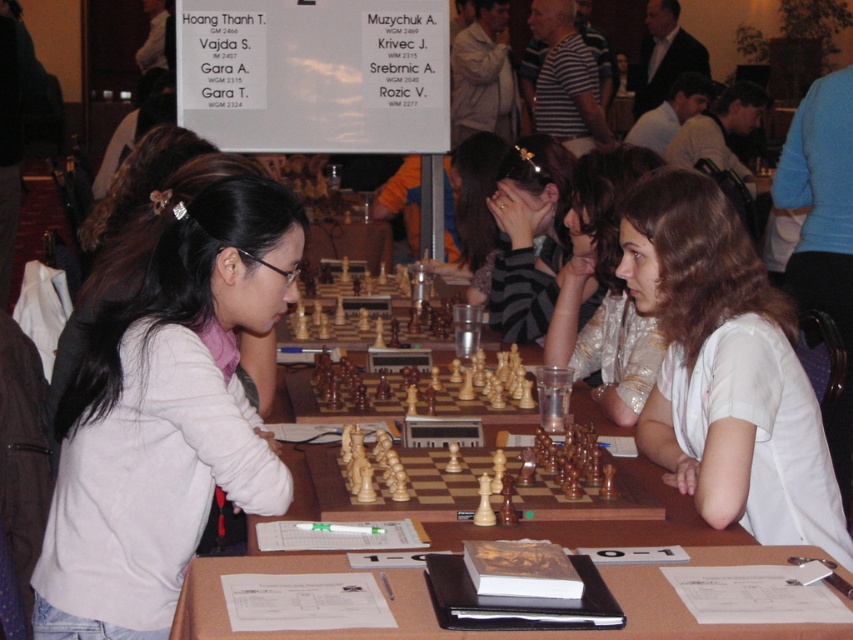
Question: Which of these objects is positioned closest to the wooden chess set at center?

Choices:
 (A) wooden table at center
 (B) white matte shirt at center
 (C) striped fabric headband at center

Answer: (C)

Question: Is striped fabric headband at center below wooden chess set at center?

Choices:
 (A) yes
 (B) no

Answer: (B)

Question: Is wooden at center thinner than wooden chess set at center?

Choices:
 (A) yes
 (B) no

Answer: (B)

Question: Which object is farther from the camera taking this photo?

Choices:
 (A) shiny silver blouse at center
 (B) white matte shirt at center
 (C) light brown wood chess set at center
 (D) wooden table at center

Answer: (A)

Question: Which object is positioned closest to the wooden at center?

Choices:
 (A) light brown wood chess set at center
 (B) striped fabric headband at center

Answer: (A)

Question: Can you confirm if wooden at center is wider than shiny silver blouse at center?

Choices:
 (A) yes
 (B) no

Answer: (A)